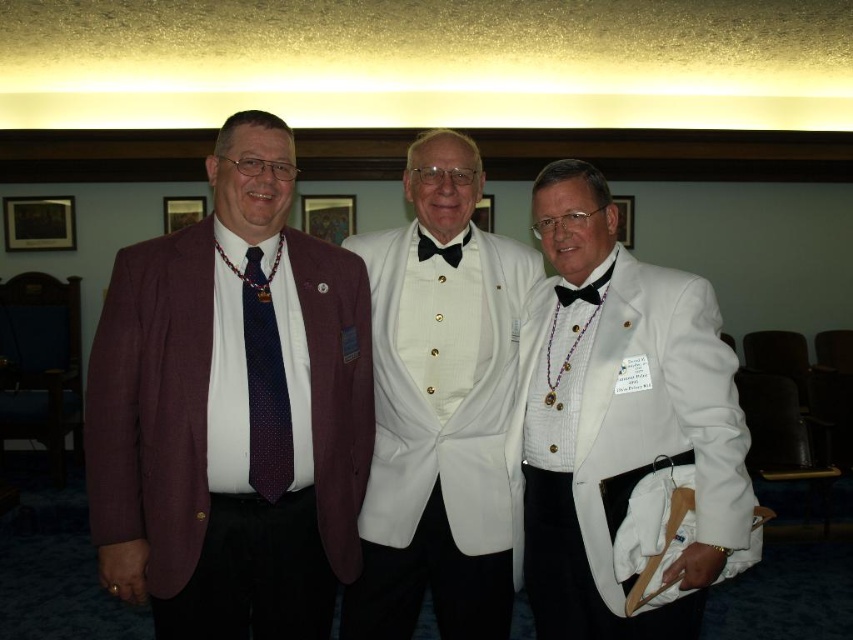
Looking at this image, who is higher up, matte maroon blazer at left or white satin tuxedo at center?

matte maroon blazer at left is above.

Does matte maroon blazer at left appear on the left side of white satin tuxedo at center?

Yes, matte maroon blazer at left is to the left of white satin tuxedo at center.

Identify the location of matte maroon blazer at left. (231, 410).

What are the coordinates of `matte maroon blazer at left` in the screenshot? It's located at point(231,410).

Can you confirm if white satin bow tie at center is positioned to the right of dark blue dotted tie at center?

Yes, white satin bow tie at center is to the right of dark blue dotted tie at center.

Who is more forward, (657, 637) or (271, 330)?

Point (657, 637) is more forward.

Who is more distant from viewer, (575, 609) or (248, 368)?

Point (575, 609)

Where is `white satin bow tie at center`? The height and width of the screenshot is (640, 853). white satin bow tie at center is located at coordinates (624, 433).

From the picture: Does matte maroon blazer at left appear under white satin bow tie at center?

Incorrect, matte maroon blazer at left is not positioned below white satin bow tie at center.

Is point (264, 580) farther from camera compared to point (531, 323)?

That is False.

This screenshot has height=640, width=853. What are the coordinates of `matte maroon blazer at left` in the screenshot? It's located at (231, 410).